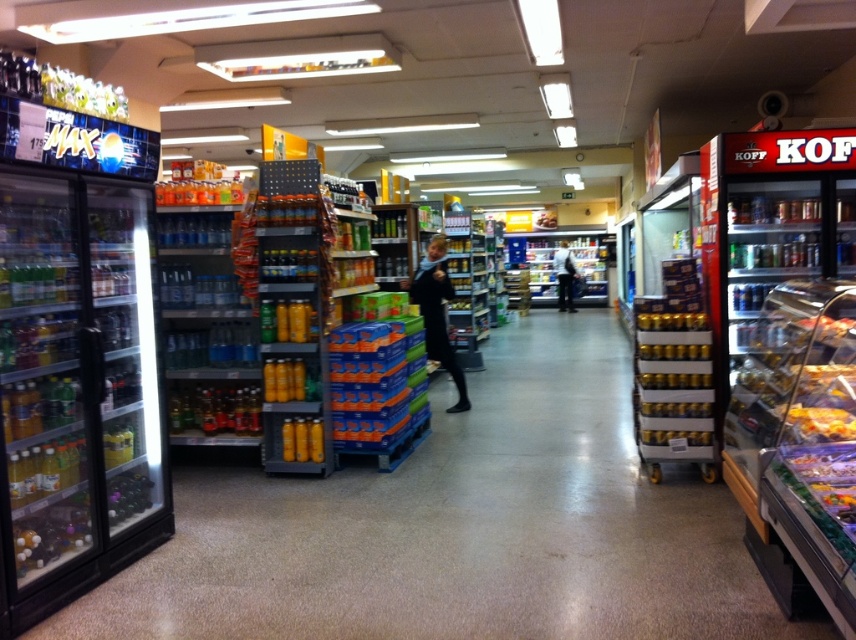
You are a grocery store employee who needs to restock the shelves. You have a yellow matte cans at center and a yellow matte canisters at center. Which one should you place on the higher shelf to ensure visibility?

The yellow matte cans at center should be placed on the higher shelf because they have a greater height compared to the yellow matte canisters at center, making them more visible when placed higher.

You are a customer in the grocery store and want to buy a black matte jacket at center. Where should you look?

The black matte jacket at center is located at point (437, 314) in the image.